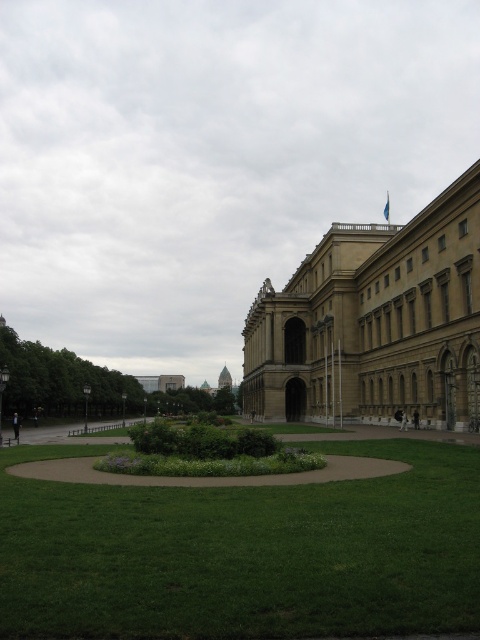
Question: From the image, what is the correct spatial relationship of green grass at center in relation to brown stone building at center?

Choices:
 (A) left
 (B) right

Answer: (A)

Question: Can you confirm if green grass at center is wider than brown stone building at center?

Choices:
 (A) no
 (B) yes

Answer: (B)

Question: Which point is farther to the camera?

Choices:
 (A) (387, 404)
 (B) (24, 628)

Answer: (A)

Question: Which of the following is the farthest from the observer?

Choices:
 (A) (342, 529)
 (B) (303, 289)

Answer: (B)

Question: Which point appears farthest from the camera in this image?

Choices:
 (A) (376, 378)
 (B) (73, 570)

Answer: (A)

Question: From the image, what is the correct spatial relationship of green grass at center in relation to brown stone building at center?

Choices:
 (A) below
 (B) above

Answer: (A)